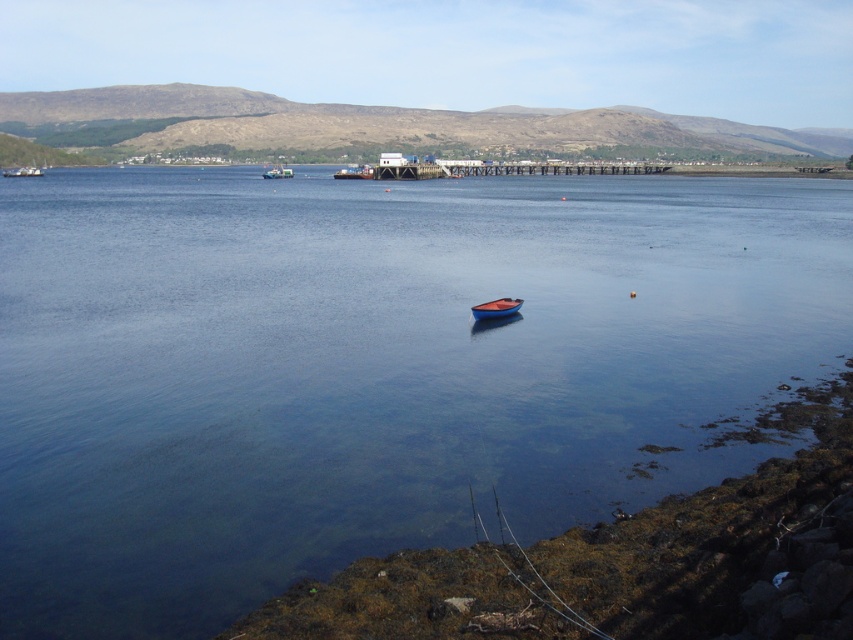
Does clear blue water at center appear on the right side of metallic silver boat at upper left?

Yes, clear blue water at center is to the right of metallic silver boat at upper left.

Measure the distance from clear blue water at center to metallic silver boat at upper left.

clear blue water at center is 85.79 meters from metallic silver boat at upper left.

Between point (619, 186) and point (10, 173), which one is positioned in front?

Point (619, 186) is in front.

Where is `clear blue water at center`? Image resolution: width=853 pixels, height=640 pixels. clear blue water at center is located at coordinates (370, 369).

Can you confirm if clear blue water at center is smaller than metallic blue boat at center?

Incorrect, clear blue water at center is not smaller in size than metallic blue boat at center.

Image resolution: width=853 pixels, height=640 pixels. Find the location of `clear blue water at center`. clear blue water at center is located at coordinates (370, 369).

Image resolution: width=853 pixels, height=640 pixels. In order to click on clear blue water at center in this screenshot , I will do `click(370, 369)`.

Which is above, blue glossy boat at center or metallic silver boat at upper left?

metallic silver boat at upper left is above.

Consider the image. Which is below, blue glossy boat at center or metallic silver boat at upper left?

Positioned lower is blue glossy boat at center.

Locate an element on the screen. The image size is (853, 640). blue glossy boat at center is located at coordinates (495, 308).